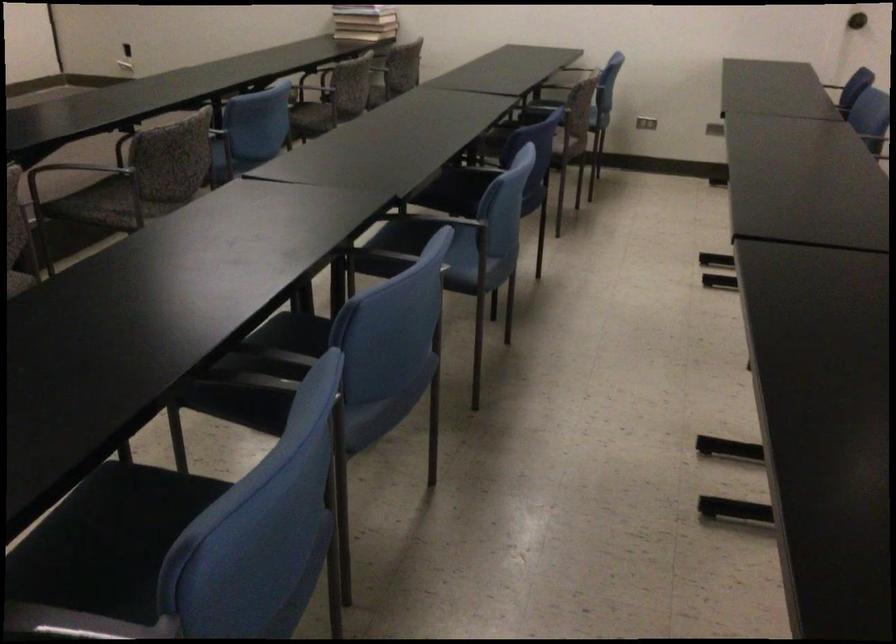
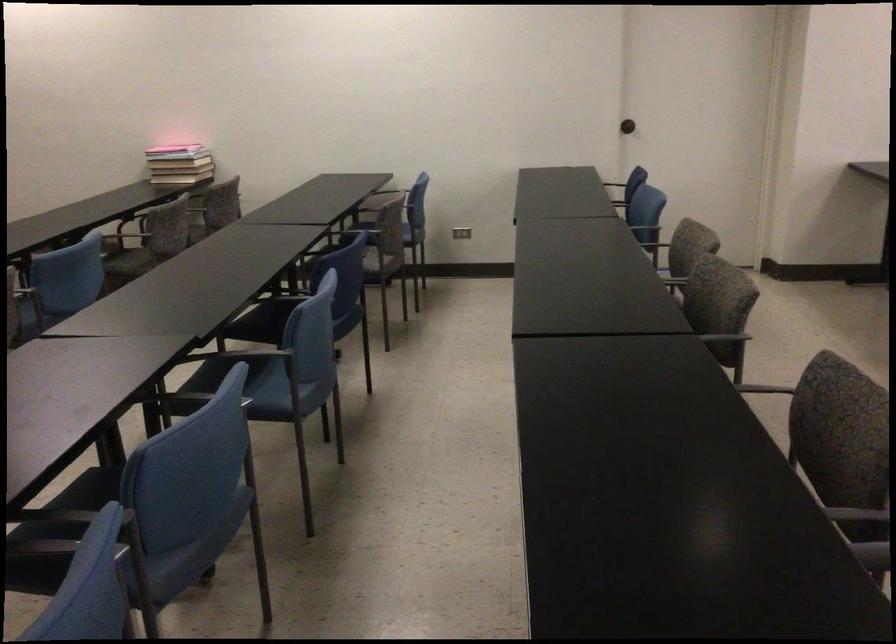
Question: I am providing you with two images of the same scene from different viewpoints. Which of the following objects are not visible in image2?

Choices:
 (A) patterned chair sitting surface
 (B) wall light switch
 (C) chair armrest
 (D) none of these

Answer: (D)